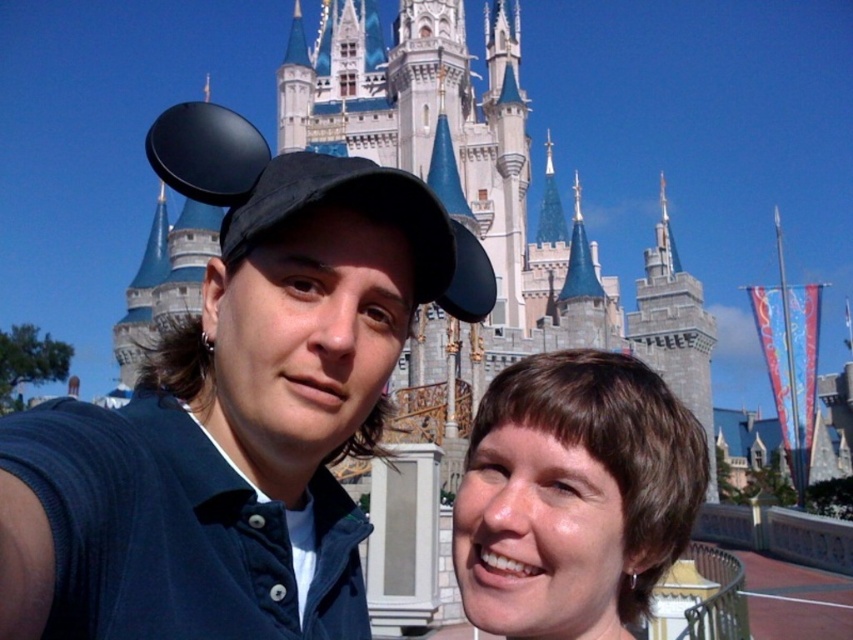
You are a photographer trying to capture a group photo of the two people in the scene. Since the white stone castle at center is a key background element, how does its size compare to the brown hair at center of the person on the right when framing the shot?

The white stone castle at center is bigger than the brown hair at center, so it will dominate the frame and make the brown hair at center appear smaller in comparison.

You are a photographer trying to capture a clear shot of both the matte black cap at center and the brown hair at center. Since you want to ensure both are visible, which object is located to the left of the other?

The matte black cap at center is positioned on the left side of brown hair at center, so the matte black cap at center is to the left of the brown hair at center.